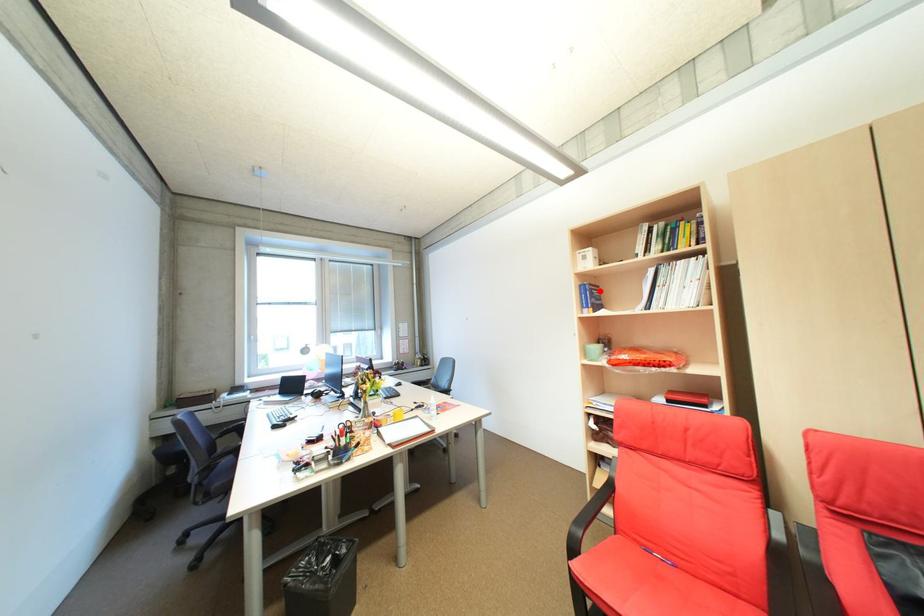
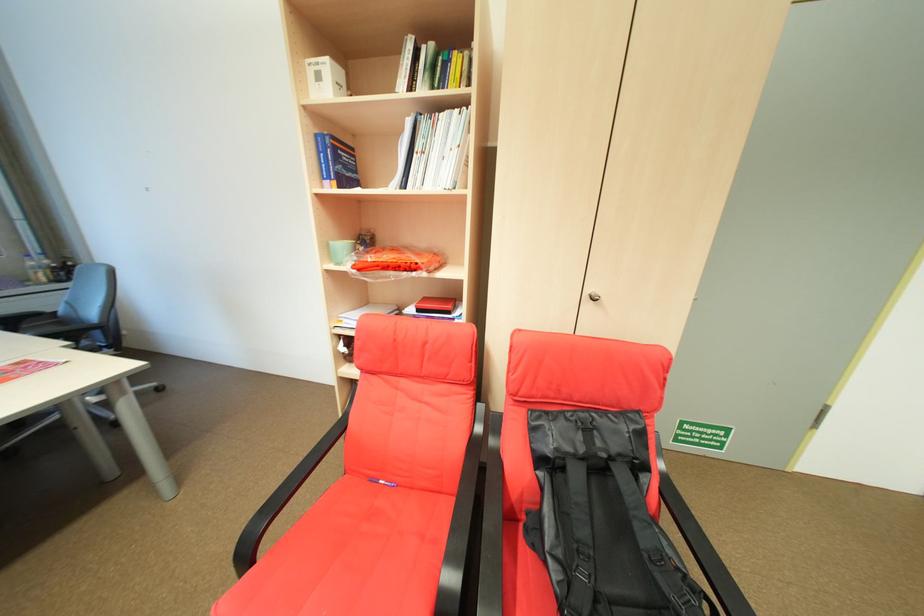
Where in the second image is the point corresponding to the highlighted location from the first image?

(344, 148)